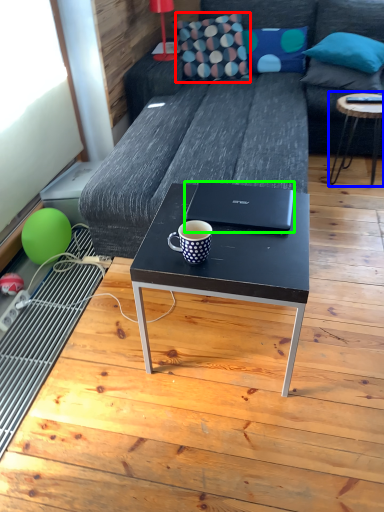
Question: Estimate the real-world distances between objects in this image. Which object is closer to throw pillow (highlighted by a red box), table (highlighted by a blue box) or laptop (highlighted by a green box)?

Choices:
 (A) table
 (B) laptop

Answer: (A)